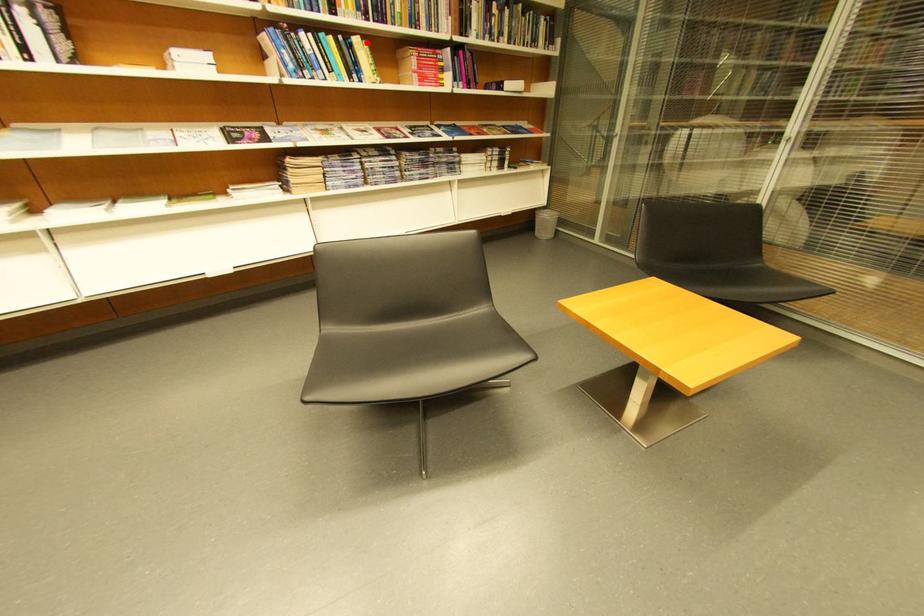
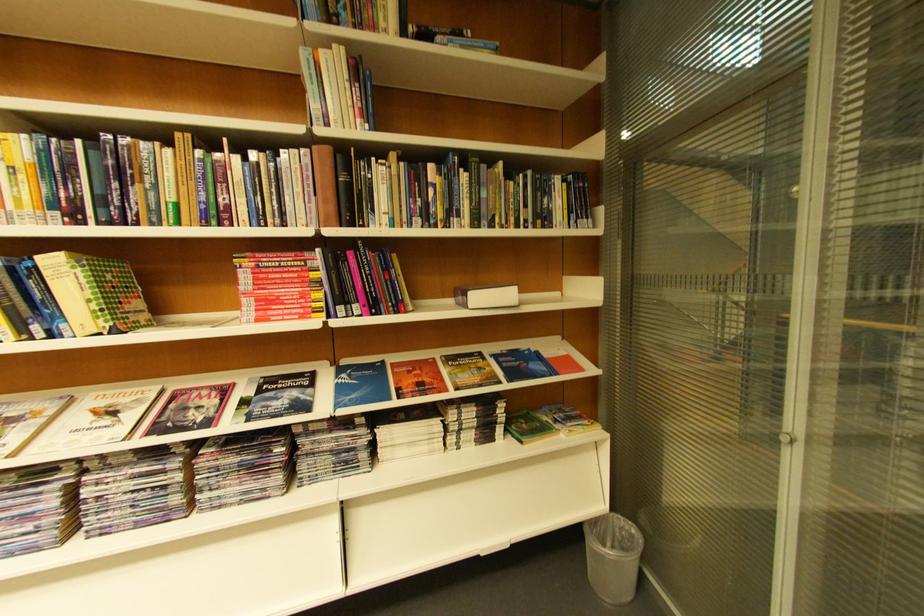
Locate, in the second image, the point that corresponds to the highlighted location in the first image.

(63, 264)